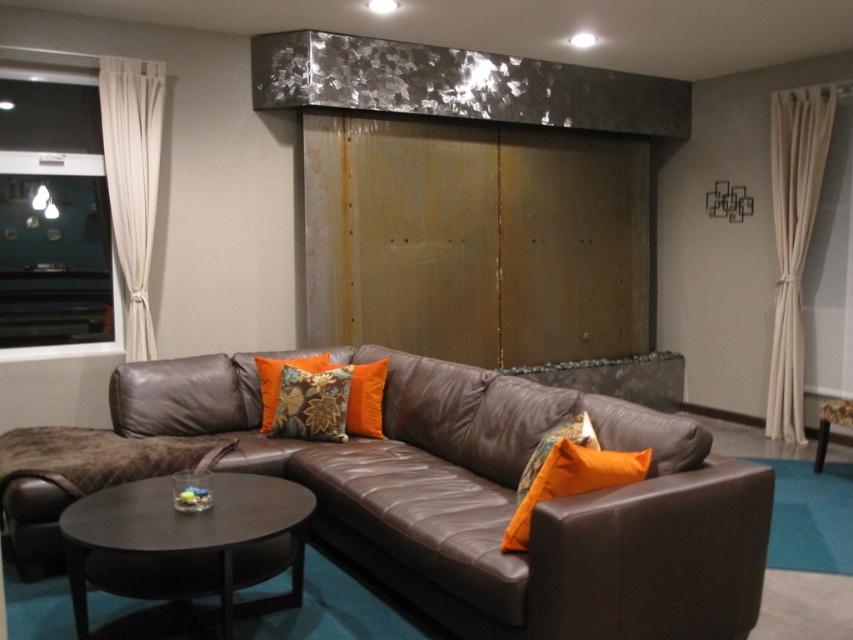
You are sitting on the brown leather couch at center and want to reach the orange textured pillow at center. Which direction should you move to get closer to the pillow?

Since the brown leather couch at center is in front of the orange textured pillow at center, you should move backward to get closer to the pillow.

You are standing in the living room and want to place a decorative vase on the dark brown wood coffee table at center. Where exactly should you place the vase?

Place the vase at point (180, 524) on the dark brown wood coffee table at center as that is the exact location of the table.

You are planning to place a new rectangular side table next to the brown leather couch at center. The side table is 2 feet wide. Considering the dark brown wood coffee table at center is already in the center, will the side table fit next to the couch without overlapping the coffee table?

The brown leather couch at center is wider than the dark brown wood coffee table at center. Since the couch is wider, there should be enough space next to it to place the 2 feet wide side table without overlapping the coffee table.